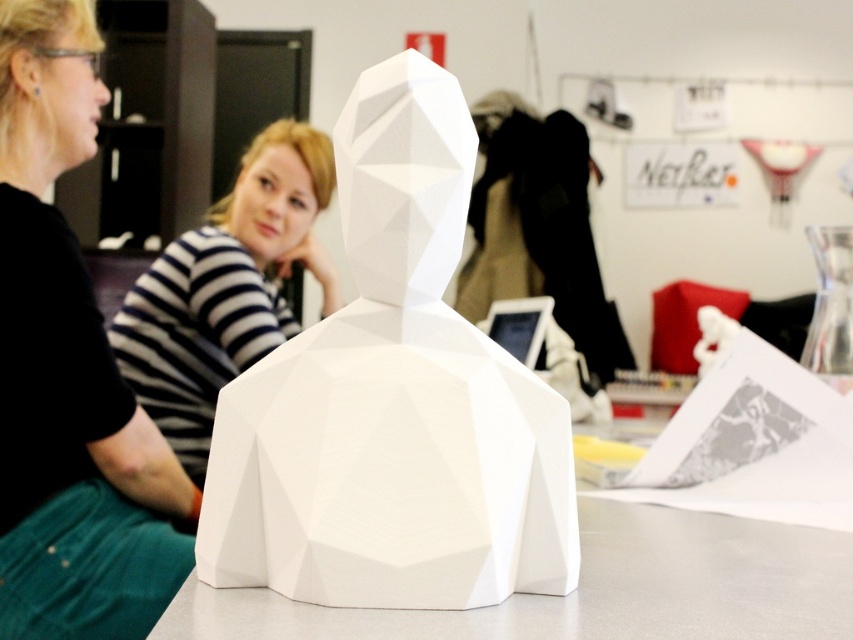
Question: Which object is closer to the camera taking this photo?

Choices:
 (A) black matte shirt at center
 (B) striped shirt at center
 (C) white matte table at center

Answer: (C)

Question: Is black matte shirt at center in front of striped shirt at center?

Choices:
 (A) yes
 (B) no

Answer: (A)

Question: From the image, what is the correct spatial relationship of black matte shirt at center in relation to white matte table at center?

Choices:
 (A) left
 (B) right

Answer: (A)

Question: Which object is the farthest from the black matte shirt at center?

Choices:
 (A) white matte table at center
 (B) striped shirt at center

Answer: (A)

Question: Can you confirm if black matte shirt at center is bigger than striped shirt at center?

Choices:
 (A) no
 (B) yes

Answer: (A)

Question: Estimate the real-world distances between objects in this image. Which object is closer to the striped shirt at center?

Choices:
 (A) black matte shirt at center
 (B) white matte table at center

Answer: (A)